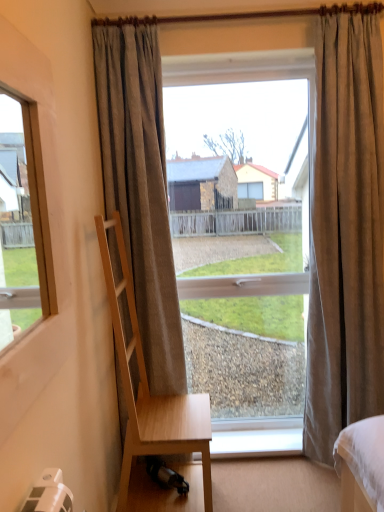
Question: From a real-world perspective, is brown textured curtain at right, which is the 2th curtain in left-to-right order, on white plastic window sill at lower center?

Choices:
 (A) yes
 (B) no

Answer: (A)

Question: Does brown textured curtain at right, which is the 2th curtain in left-to-right order, have a lesser height compared to white plastic window sill at lower center?

Choices:
 (A) yes
 (B) no

Answer: (B)

Question: Is brown textured curtain at right, which is the 2th curtain in left-to-right order, outside white plastic window sill at lower center?

Choices:
 (A) yes
 (B) no

Answer: (A)

Question: Does brown textured curtain at right, which is the 2th curtain in left-to-right order, turn towards white plastic window sill at lower center?

Choices:
 (A) yes
 (B) no

Answer: (B)

Question: From the image's perspective, is brown textured curtain at right, the 1th curtain positioned from the right, below white plastic window sill at lower center?

Choices:
 (A) no
 (B) yes

Answer: (A)

Question: Is brown textured curtain at right, which is the 2th curtain in left-to-right order, behind white plastic window sill at lower center?

Choices:
 (A) yes
 (B) no

Answer: (B)

Question: From the image's perspective, would you say clear glass window at center is shown under gray textured curtain at center, which is the first curtain in left-to-right order?

Choices:
 (A) no
 (B) yes

Answer: (A)

Question: From a real-world perspective, is clear glass window at center physically above gray textured curtain at center, acting as the 2th curtain starting from the right?

Choices:
 (A) yes
 (B) no

Answer: (B)

Question: Is clear glass window at center outside of gray textured curtain at center, which is the first curtain in left-to-right order?

Choices:
 (A) no
 (B) yes

Answer: (B)

Question: Is clear glass window at center facing away from gray textured curtain at center, acting as the 2th curtain starting from the right?

Choices:
 (A) yes
 (B) no

Answer: (B)

Question: Is clear glass window at center placed right next to gray textured curtain at center, acting as the 2th curtain starting from the right?

Choices:
 (A) yes
 (B) no

Answer: (B)

Question: From a real-world perspective, is clear glass window at center physically below gray textured curtain at center, acting as the 2th curtain starting from the right?

Choices:
 (A) yes
 (B) no

Answer: (A)

Question: Considering the relative positions of brown textured curtain at right, which is the 2th curtain in left-to-right order, and light wood chair at left in the image provided, is brown textured curtain at right, which is the 2th curtain in left-to-right order, to the right of light wood chair at left from the viewer's perspective?

Choices:
 (A) no
 (B) yes

Answer: (B)